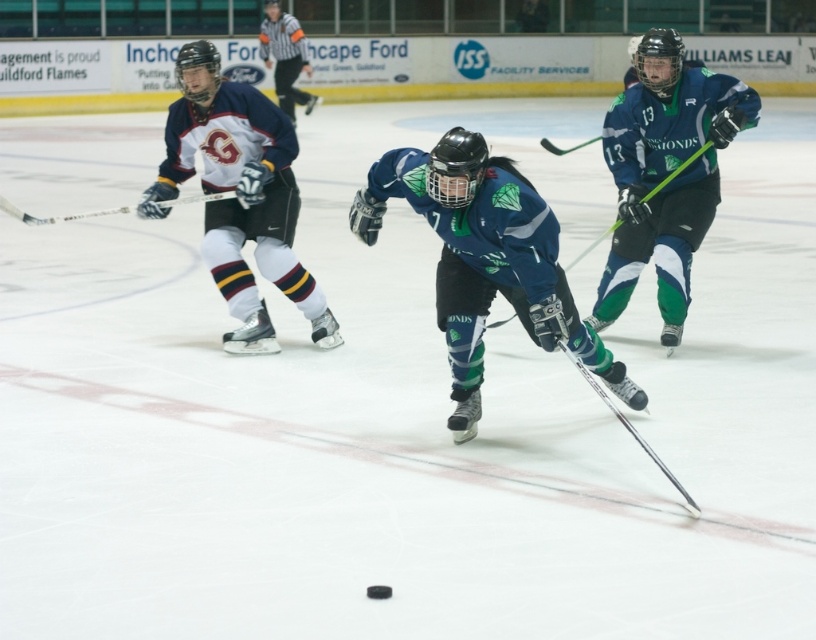
Is shiny blue hockey stick at center bigger than green matte hockey stick at center?

Yes, shiny blue hockey stick at center is bigger than green matte hockey stick at center.

Which is in front, point (511, 276) or point (503, 321)?

Point (511, 276) is in front.

The width and height of the screenshot is (816, 640). What are the coordinates of `shiny blue hockey stick at center` in the screenshot? It's located at (486, 259).

Is white jersey at upper center wider than shiny black hockey stick at center?

Indeed, white jersey at upper center has a greater width compared to shiny black hockey stick at center.

Is white jersey at upper center positioned at the back of shiny black hockey stick at center?

Yes, white jersey at upper center is further from the viewer.

What do you see at coordinates (285, 56) in the screenshot? I see `white jersey at upper center` at bounding box center [285, 56].

What are the coordinates of `white jersey at upper center` in the screenshot? It's located at (285, 56).

Can you confirm if shiny blue hockey stick at center is taller than white matte jersey at left?

In fact, shiny blue hockey stick at center may be shorter than white matte jersey at left.

In order to click on shiny blue hockey stick at center in this screenshot , I will do `click(486, 259)`.